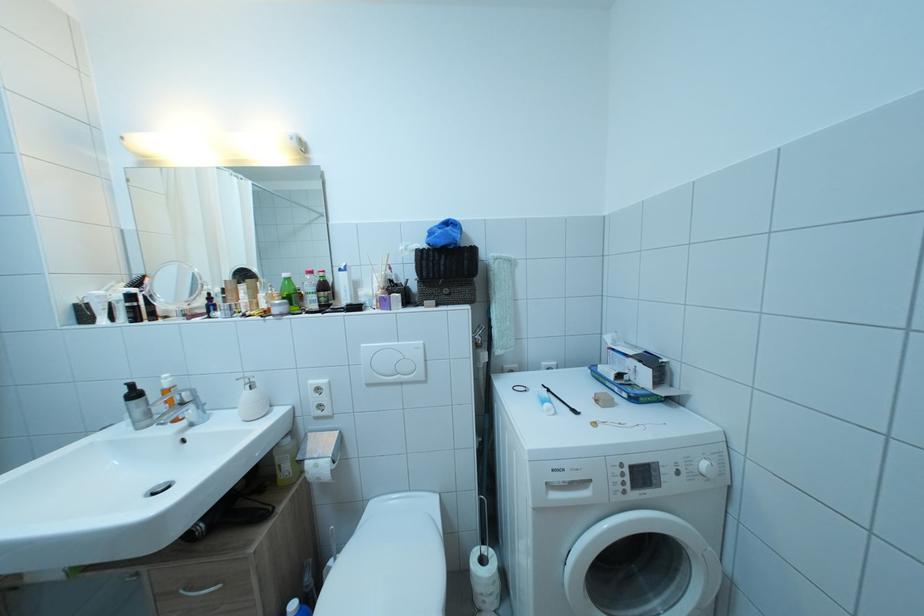
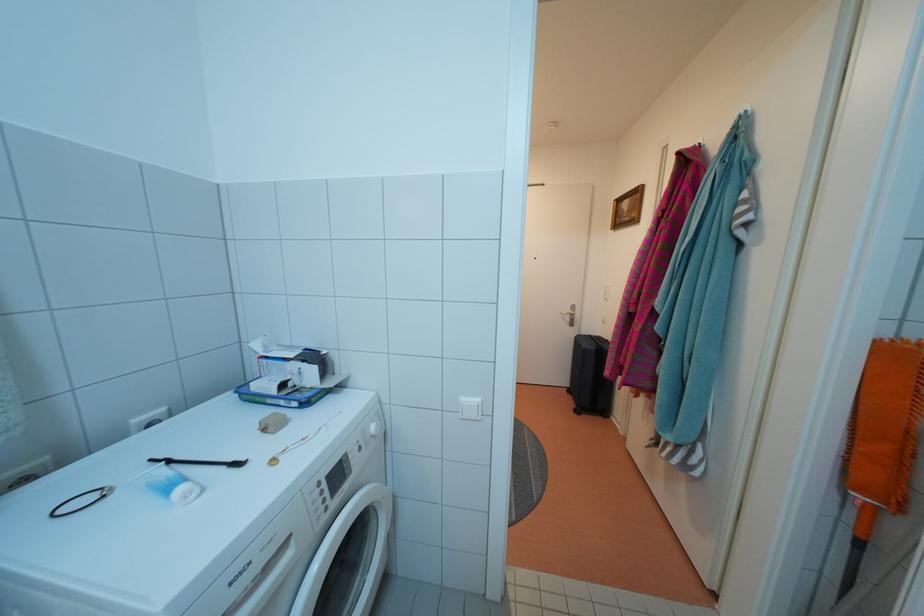
In the second image, find the point that corresponds to [618,384] in the first image.

(282, 398)